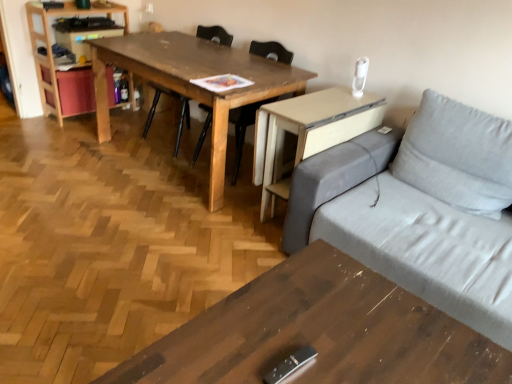
Describe the element at coordinates (319, 333) in the screenshot. I see `wooden coffee table at lower center, which ranks as the 2th table in top-to-bottom order` at that location.

At what (x,y) coordinates should I click in order to perform the action: click on wooden coffee table at lower center, which appears as the 2th table when viewed from the back. Please return your answer as a coordinate pair (x, y). Looking at the image, I should click on (319, 333).

What do you see at coordinates (192, 84) in the screenshot? The width and height of the screenshot is (512, 384). I see `wooden table at center, acting as the first table starting from the back` at bounding box center [192, 84].

This screenshot has height=384, width=512. In order to click on wooden chair at center, which ranks as the first chair in right-to-left order in this screenshot , I will do `click(246, 126)`.

Identify the location of wooden coffee table at lower center, which ranks as the 2th table in top-to-bottom order. The height and width of the screenshot is (384, 512). (319, 333).

Is wooden table at center, the second table in the front-to-back sequence, thinner than light wood bookshelf at left?

Incorrect, the width of wooden table at center, the second table in the front-to-back sequence, is not less than that of light wood bookshelf at left.

Is wooden table at center, the second table in the front-to-back sequence, aimed at light wood bookshelf at left?

No, wooden table at center, the second table in the front-to-back sequence, does not turn towards light wood bookshelf at left.

From a real-world perspective, which object rests below the other?

wooden table at center, the second table in the front-to-back sequence.

Is wooden table at center, which is counted as the 2th table, starting from the bottom, not within light wood bookshelf at left?

Indeed, wooden table at center, which is counted as the 2th table, starting from the bottom, is completely outside light wood bookshelf at left.

Locate an element on the screen. The height and width of the screenshot is (384, 512). bookshelf located above the wooden chair at center, the first chair when ordered from left to right (from the image's perspective) is located at coordinates (52, 50).

Is light wood bookshelf at left positioned far away from wooden chair at center, the second chair in the right-to-left sequence?

No, there isn't a large distance between light wood bookshelf at left and wooden chair at center, the second chair in the right-to-left sequence.

Looking at their sizes, would you say light wood bookshelf at left is wider or thinner than wooden chair at center, the second chair in the right-to-left sequence?

light wood bookshelf at left is thinner than wooden chair at center, the second chair in the right-to-left sequence.

Is wooden chair at center, the first chair when ordered from left to right, a part of light wood bookshelf at left?

No, wooden chair at center, the first chair when ordered from left to right, is not a part of light wood bookshelf at left.

Considering the relative sizes of wooden chair at center, the second chair in the right-to-left sequence, and beige wood computer desk at right in the image provided, is wooden chair at center, the second chair in the right-to-left sequence, bigger than beige wood computer desk at right?

Yes, wooden chair at center, the second chair in the right-to-left sequence, is bigger than beige wood computer desk at right.

Considering the positions of objects wooden chair at center, the second chair in the right-to-left sequence, and beige wood computer desk at right in the image provided, who is in front, wooden chair at center, the second chair in the right-to-left sequence, or beige wood computer desk at right?

Positioned in front is beige wood computer desk at right.

Which object is thinner, wooden chair at center, the first chair when ordered from left to right, or beige wood computer desk at right?

wooden chair at center, the first chair when ordered from left to right.

Considering the relative sizes of beige wood computer desk at right and light wood bookshelf at left in the image provided, is beige wood computer desk at right shorter than light wood bookshelf at left?

Correct, beige wood computer desk at right is not as tall as light wood bookshelf at left.

From the image's perspective, between beige wood computer desk at right and light wood bookshelf at left, who is located below?

beige wood computer desk at right is shown below in the image.

Is beige wood computer desk at right facing away from light wood bookshelf at left?

beige wood computer desk at right does not have its back to light wood bookshelf at left.

Considering the relative sizes of beige wood computer desk at right and light wood bookshelf at left in the image provided, is beige wood computer desk at right thinner than light wood bookshelf at left?

No, beige wood computer desk at right is not thinner than light wood bookshelf at left.

Is wooden chair at center, the second chair in the right-to-left sequence, inside the boundaries of light wood bookshelf at left, or outside?

wooden chair at center, the second chair in the right-to-left sequence, lies outside light wood bookshelf at left.

Considering the relative sizes of wooden chair at center, the first chair when ordered from left to right, and light wood bookshelf at left in the image provided, is wooden chair at center, the first chair when ordered from left to right, smaller than light wood bookshelf at left?

Incorrect, wooden chair at center, the first chair when ordered from left to right, is not smaller in size than light wood bookshelf at left.

Is wooden chair at center, the first chair when ordered from left to right, facing away from light wood bookshelf at left?

wooden chair at center, the first chair when ordered from left to right, does not have its back to light wood bookshelf at left.

Is point (160, 90) positioned in front of point (51, 52)?

No.

Is wooden chair at center, which ranks as the first chair in right-to-left order, looking in the opposite direction of beige wood computer desk at right?

wooden chair at center, which ranks as the first chair in right-to-left order, does not have its back to beige wood computer desk at right.

Which is more to the right, wooden chair at center, which ranks as the first chair in right-to-left order, or beige wood computer desk at right?

beige wood computer desk at right is more to the right.

Is wooden chair at center, which ranks as the first chair in right-to-left order, not near beige wood computer desk at right?

Actually, wooden chair at center, which ranks as the first chair in right-to-left order, and beige wood computer desk at right are a little close together.

How different are the orientations of light wood bookshelf at left and beige wood computer desk at right in degrees?

The facing directions of light wood bookshelf at left and beige wood computer desk at right are 90.7 degrees apart.

Considering the relative positions of light wood bookshelf at left and beige wood computer desk at right in the image provided, is light wood bookshelf at left to the right of beige wood computer desk at right from the viewer's perspective?

In fact, light wood bookshelf at left is to the left of beige wood computer desk at right.

Is light wood bookshelf at left taller than beige wood computer desk at right?

Yes.

Can you confirm if light wood bookshelf at left is thinner than beige wood computer desk at right?

Correct, the width of light wood bookshelf at left is less than that of beige wood computer desk at right.

From the image's perspective, count 1st tables downward from the light wood bookshelf at left and point to it. Please provide its 2D coordinates.

[(192, 84)]

The image size is (512, 384). Identify the location of bookshelf above the wooden chair at center, the second chair in the right-to-left sequence (from the image's perspective). (52, 50).

Estimate the real-world distances between objects in this image. Which object is closer to wooden table at center, which is counted as the 2th table, starting from the bottom, wooden coffee table at lower center, the first table from the bottom, or wooden chair at center, the second chair in the right-to-left sequence?

Among the two, wooden chair at center, the second chair in the right-to-left sequence, is located nearer to wooden table at center, which is counted as the 2th table, starting from the bottom.

Considering their positions, is wooden chair at center, acting as the 2th chair starting from the left, positioned further to wooden table at center, the second table in the front-to-back sequence, than beige wood computer desk at right?

wooden chair at center, acting as the 2th chair starting from the left, is positioned further to the anchor wooden table at center, the second table in the front-to-back sequence.

Looking at the image, which one is located closer to wooden chair at center, the first chair when ordered from left to right, beige wood computer desk at right or wooden table at center, the second table in the front-to-back sequence?

wooden table at center, the second table in the front-to-back sequence, lies closer to wooden chair at center, the first chair when ordered from left to right, than the other object.

When comparing their distances from wooden chair at center, the first chair when ordered from left to right, does wooden coffee table at lower center, the first table from the bottom, or wooden chair at center, which ranks as the first chair in right-to-left order, seem closer?

The object closer to wooden chair at center, the first chair when ordered from left to right, is wooden chair at center, which ranks as the first chair in right-to-left order.

Which object lies further to the anchor point wooden chair at center, acting as the 2th chair starting from the left, wooden chair at center, the second chair in the right-to-left sequence, or light wood bookshelf at left?

Among the two, light wood bookshelf at left is located further to wooden chair at center, acting as the 2th chair starting from the left.

Estimate the real-world distances between objects in this image. Which object is further from beige wood computer desk at right, wooden coffee table at lower center, the first table from the bottom, or wooden chair at center, the first chair when ordered from left to right?

wooden chair at center, the first chair when ordered from left to right, is positioned further to the anchor beige wood computer desk at right.

Looking at this image, from the image, which object appears to be farther from beige wood computer desk at right, wooden coffee table at lower center, the first table from the bottom, or light wood bookshelf at left?

light wood bookshelf at left is positioned further to the anchor beige wood computer desk at right.

Which object lies further to the anchor point wooden coffee table at lower center, the 1th table viewed from the front, wooden chair at center, the first chair when ordered from left to right, or wooden chair at center, acting as the 2th chair starting from the left?

wooden chair at center, the first chair when ordered from left to right, is positioned further to the anchor wooden coffee table at lower center, the 1th table viewed from the front.

Identify the location of table between wooden coffee table at lower center, which ranks as the 2th table in top-to-bottom order, and wooden chair at center, acting as the 2th chair starting from the left, from front to back. (192, 84).

The height and width of the screenshot is (384, 512). I want to click on computer desk between wooden coffee table at lower center, which ranks as the 2th table in top-to-bottom order, and light wood bookshelf at left, along the z-axis, so click(x=307, y=132).

You are a GUI agent. You are given a task and a screenshot of the screen. Output one action in this format:
    pyautogui.click(x=<x>, y=<y>)
    Task: Click on the table located between wooden coffee table at lower center, which ranks as the 2th table in top-to-bottom order, and light wood bookshelf at left in the depth direction
    This screenshot has width=512, height=384.
    Given the screenshot: What is the action you would take?
    pyautogui.click(x=192, y=84)

Find the location of `computer desk located between wooden coffee table at lower center, which appears as the 2th table when viewed from the back, and wooden chair at center, acting as the 2th chair starting from the left, in the depth direction`. computer desk located between wooden coffee table at lower center, which appears as the 2th table when viewed from the back, and wooden chair at center, acting as the 2th chair starting from the left, in the depth direction is located at coordinates (307, 132).